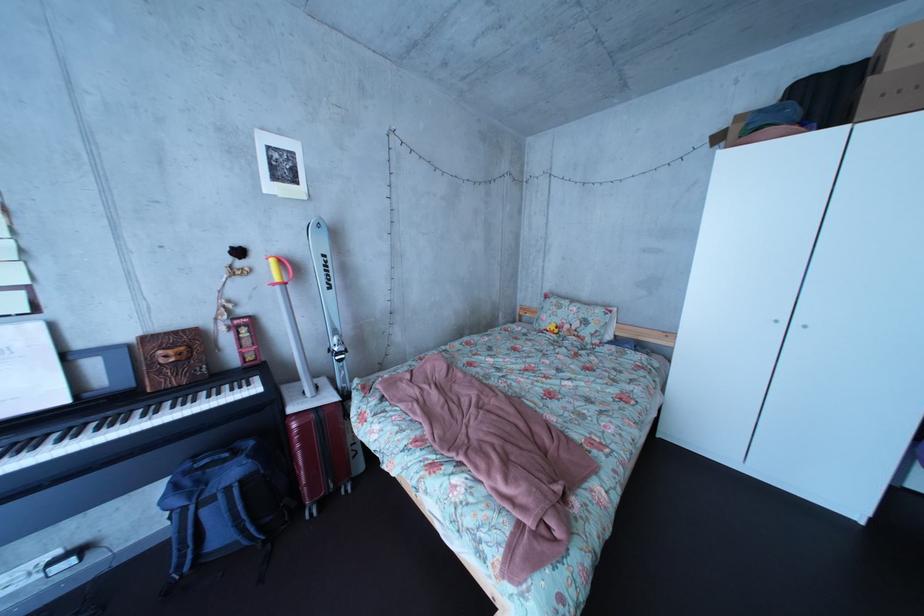
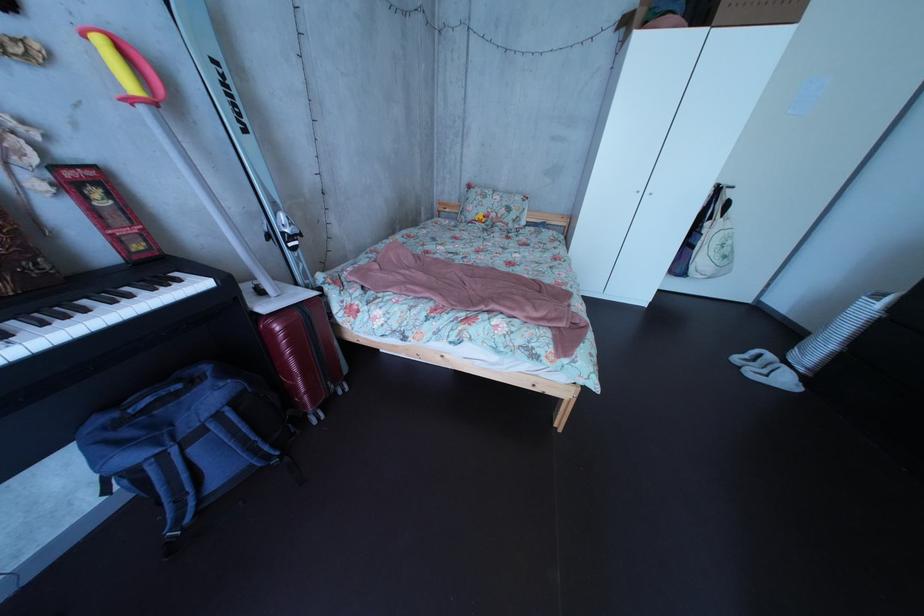
The point at (573, 320) is marked in the first image. Where is the corresponding point in the second image?

(499, 209)